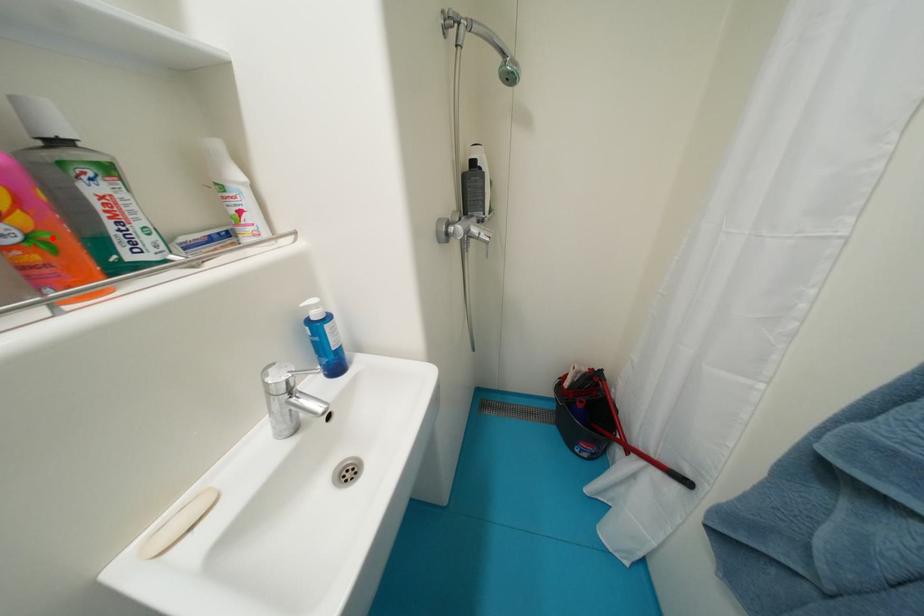
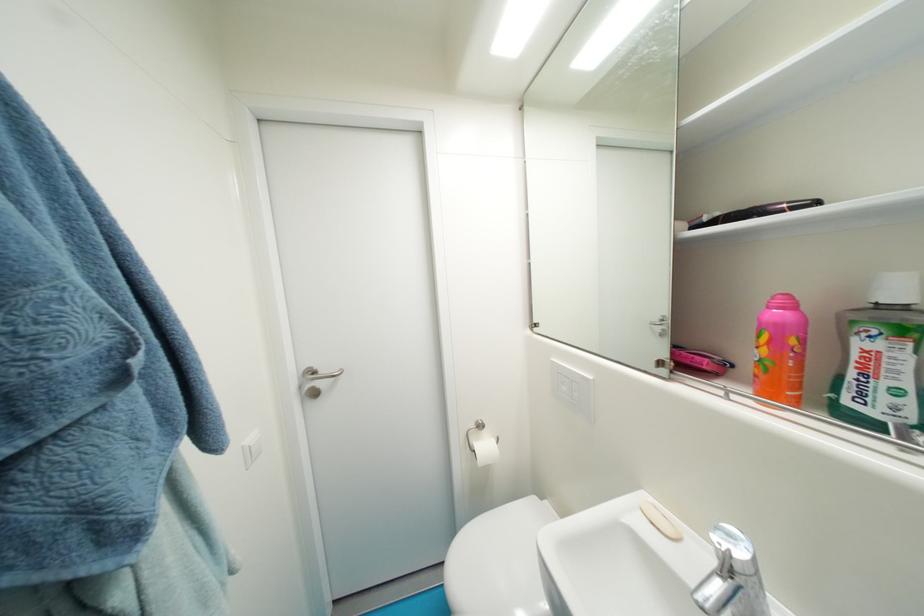
Find the pixel in the second image that matches the highlighted location in the first image.

(774, 363)